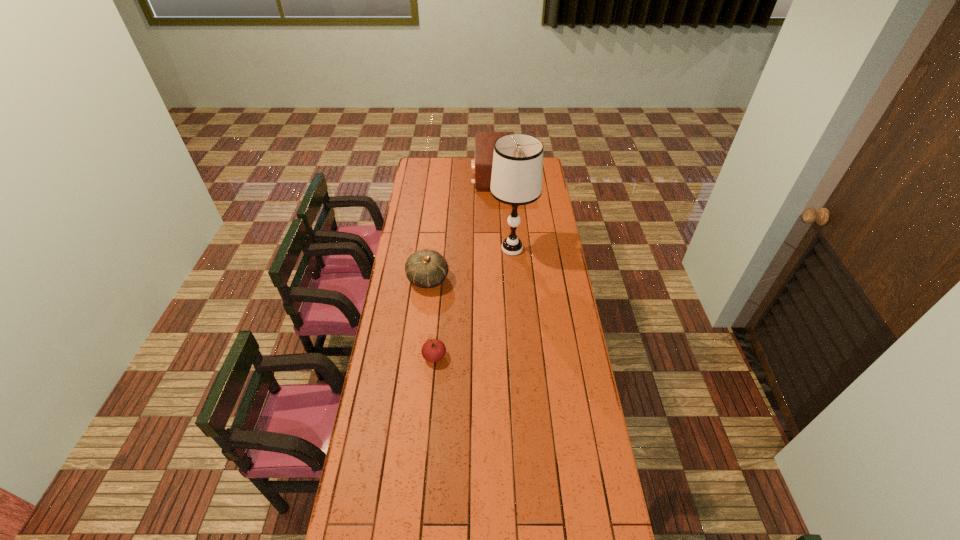
Where is `free spot that satisfies the following two spatial constraints: 1. on the back side of the tallest object; 2. on the right side of the second shortest object`? The height and width of the screenshot is (540, 960). free spot that satisfies the following two spatial constraints: 1. on the back side of the tallest object; 2. on the right side of the second shortest object is located at coordinates (432, 249).